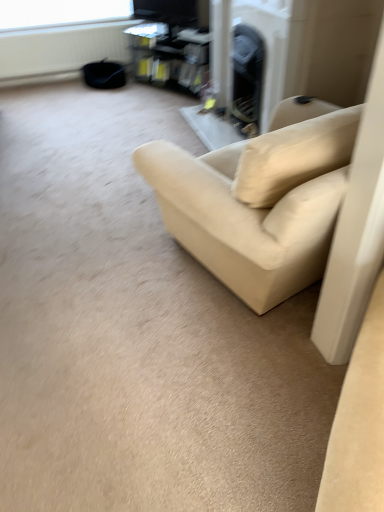
Image resolution: width=384 pixels, height=512 pixels. Identify the location of white matte radiator at upper left. tap(60, 51).

You are a GUI agent. You are given a task and a screenshot of the screen. Output one action in this format:
    pyautogui.click(x=<x>, y=<y>)
    Task: Click on the matte black entertainment center at upper center
    The image size is (384, 512).
    Given the screenshot: What is the action you would take?
    pyautogui.click(x=173, y=42)

Is transparent plastic window screen at upper center looking in the opposite direction of beige fabric couch at center?

No.

Considering the sizes of objects transparent plastic window screen at upper center and beige fabric couch at center in the image provided, who is taller, transparent plastic window screen at upper center or beige fabric couch at center?

Standing taller between the two is beige fabric couch at center.

Considering the relative sizes of transparent plastic window screen at upper center and beige fabric couch at center in the image provided, is transparent plastic window screen at upper center bigger than beige fabric couch at center?

Incorrect, transparent plastic window screen at upper center is not larger than beige fabric couch at center.

Does beige fabric couch at center touch white matte radiator at upper left?

No, beige fabric couch at center is not making contact with white matte radiator at upper left.

Who is more distant, beige fabric couch at center or white matte radiator at upper left?

white matte radiator at upper left is further from the camera.

From a real-world perspective, between beige fabric couch at center and white matte radiator at upper left, who is vertically higher?

In real-world perspective, beige fabric couch at center is above.

Is beige fabric couch at center not close to matte black entertainment center at upper center?

beige fabric couch at center is far away from matte black entertainment center at upper center.

From the image's perspective, which one is positioned lower, beige fabric couch at center or matte black entertainment center at upper center?

beige fabric couch at center, from the image's perspective.

Which is closer to the camera, (295,189) or (198,69)?

Point (295,189).

From a real-world perspective, which object rests below the other?

In real-world perspective, matte black entertainment center at upper center is lower.

Is matte black entertainment center at upper center at the back of transparent plastic window screen at upper center?

No, matte black entertainment center at upper center is not at the back of transparent plastic window screen at upper center.

Does transparent plastic window screen at upper center have a greater width compared to matte black entertainment center at upper center?

No, transparent plastic window screen at upper center is not wider than matte black entertainment center at upper center.

From a real-world perspective, is transparent plastic window screen at upper center under matte black entertainment center at upper center?

Actually, transparent plastic window screen at upper center is physically above matte black entertainment center at upper center in the real world.

Measure the distance between transparent plastic window screen at upper center and matte black entertainment center at upper center.

transparent plastic window screen at upper center is 63.58 centimeters away from matte black entertainment center at upper center.

From a real-world perspective, does transparent plastic window screen at upper center stand above white matte radiator at upper left?

Yes.

Is transparent plastic window screen at upper center in front of or behind white matte radiator at upper left in the image?

transparent plastic window screen at upper center is positioned closer to the viewer than white matte radiator at upper left.

Consider the image. How many degrees apart are the facing directions of transparent plastic window screen at upper center and white matte radiator at upper left?

The angular difference between transparent plastic window screen at upper center and white matte radiator at upper left is 0.286 degrees.

Can you confirm if transparent plastic window screen at upper center is wider than white matte radiator at upper left?

No, transparent plastic window screen at upper center is not wider than white matte radiator at upper left.

Based on the photo, is white matte radiator at upper left turned away from beige fabric couch at center?

That's not correct — white matte radiator at upper left is not looking away from beige fabric couch at center.

This screenshot has height=512, width=384. In order to click on radiator located on the left of beige fabric couch at center in this screenshot , I will do (60, 51).

Which of these two, white matte radiator at upper left or beige fabric couch at center, is smaller?

With smaller size is white matte radiator at upper left.

Does beige fabric couch at center come in front of transparent plastic window screen at upper center?

Yes.

From a real-world perspective, who is located higher, beige fabric couch at center or transparent plastic window screen at upper center?

From a 3D spatial view, transparent plastic window screen at upper center is above.

Considering the relative sizes of beige fabric couch at center and transparent plastic window screen at upper center in the image provided, is beige fabric couch at center shorter than transparent plastic window screen at upper center?

Incorrect, the height of beige fabric couch at center does not fall short of that of transparent plastic window screen at upper center.

At what (x,y) coordinates should I click in order to perform the action: click on window screen that is on the left side of beige fabric couch at center. Please return your answer as a coordinate pair (x, y). Image resolution: width=384 pixels, height=512 pixels. Looking at the image, I should click on (60, 12).

Where is `radiator lying above the beige fabric couch at center (from the image's perspective)`? The width and height of the screenshot is (384, 512). radiator lying above the beige fabric couch at center (from the image's perspective) is located at coordinates (60, 51).

Considering their positions, is white matte radiator at upper left positioned further to matte black entertainment center at upper center than transparent plastic window screen at upper center?

Among the two, transparent plastic window screen at upper center is located further to matte black entertainment center at upper center.

Which object lies nearer to the anchor point transparent plastic window screen at upper center, matte black entertainment center at upper center or beige fabric couch at center?

matte black entertainment center at upper center is closer to transparent plastic window screen at upper center.

Estimate the real-world distances between objects in this image. Which object is closer to beige fabric couch at center, matte black entertainment center at upper center or white matte radiator at upper left?

matte black entertainment center at upper center lies closer to beige fabric couch at center than the other object.

When comparing their distances from white matte radiator at upper left, does transparent plastic window screen at upper center or matte black entertainment center at upper center seem further?

matte black entertainment center at upper center is positioned further to the anchor white matte radiator at upper left.

When comparing their distances from matte black entertainment center at upper center, does beige fabric couch at center or white matte radiator at upper left seem further?

beige fabric couch at center is further to matte black entertainment center at upper center.

Based on their spatial positions, is beige fabric couch at center or transparent plastic window screen at upper center closer to matte black entertainment center at upper center?

transparent plastic window screen at upper center.

When comparing their distances from beige fabric couch at center, does transparent plastic window screen at upper center or white matte radiator at upper left seem further?

transparent plastic window screen at upper center is positioned further to the anchor beige fabric couch at center.

From the image, which object appears to be farther from white matte radiator at upper left, matte black entertainment center at upper center or beige fabric couch at center?

beige fabric couch at center lies further to white matte radiator at upper left than the other object.

Where is `entertainment center between beige fabric couch at center and white matte radiator at upper left from front to back`? The width and height of the screenshot is (384, 512). entertainment center between beige fabric couch at center and white matte radiator at upper left from front to back is located at coordinates (173, 42).

This screenshot has width=384, height=512. I want to click on radiator situated between transparent plastic window screen at upper center and matte black entertainment center at upper center from left to right, so click(60, 51).

This screenshot has height=512, width=384. In order to click on entertainment center between beige fabric couch at center and transparent plastic window screen at upper center from front to back in this screenshot , I will do `click(173, 42)`.

The width and height of the screenshot is (384, 512). Find the location of `window screen between beige fabric couch at center and white matte radiator at upper left from front to back`. window screen between beige fabric couch at center and white matte radiator at upper left from front to back is located at coordinates [60, 12].